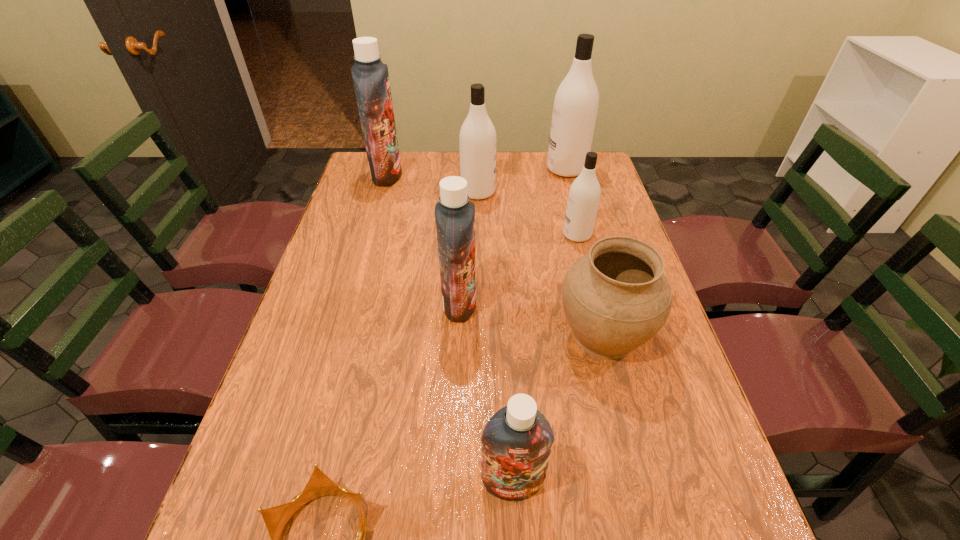
Identify the location of the biggest white shampoo. (576, 101).

This screenshot has height=540, width=960. Find the location of `the farthest blue shampoo`. the farthest blue shampoo is located at coordinates (370, 75).

Locate an element on the screen. The width and height of the screenshot is (960, 540). the leftmost shampoo is located at coordinates (370, 75).

Where is `the second nearest shampoo`? The height and width of the screenshot is (540, 960). the second nearest shampoo is located at coordinates (454, 213).

The width and height of the screenshot is (960, 540). In order to click on the second nearest blue shampoo in this screenshot , I will do `click(454, 213)`.

At what (x,y) coordinates should I click in order to perform the action: click on the leftmost white shampoo. Please return your answer as a coordinate pair (x, y). This screenshot has height=540, width=960. Looking at the image, I should click on (477, 141).

Identify the location of the second smallest white shampoo. The width and height of the screenshot is (960, 540). (477, 141).

Find the location of a particular element. Image resolution: width=960 pixels, height=540 pixels. the fifth nearest object is located at coordinates (583, 199).

You are a GUI agent. You are given a task and a screenshot of the screen. Output one action in this format:
    pyautogui.click(x=<x>, y=<y>)
    Task: Click on the third nearest shampoo
    The image size is (960, 540).
    Given the screenshot: What is the action you would take?
    pyautogui.click(x=583, y=199)

I want to click on the nearest blue shampoo, so pyautogui.click(x=517, y=440).